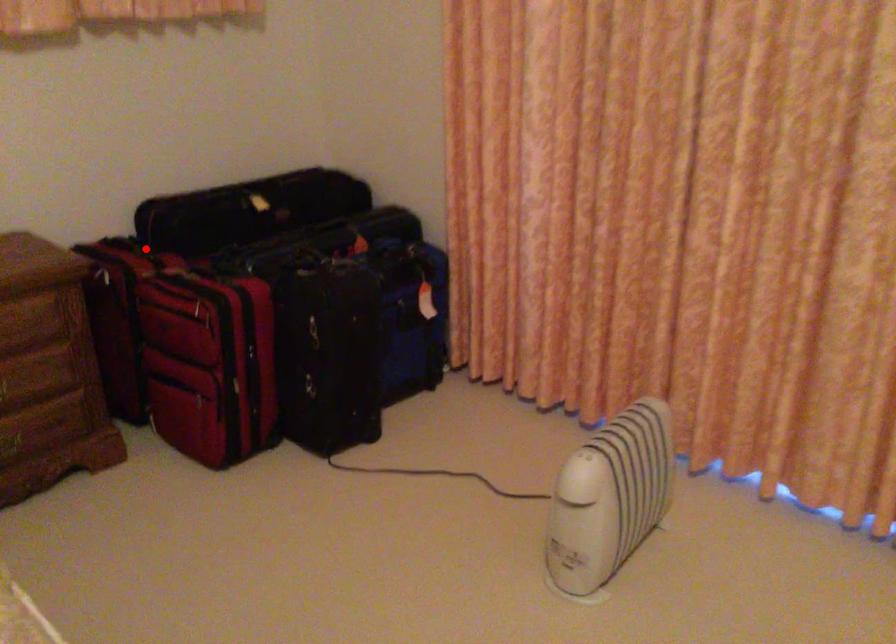
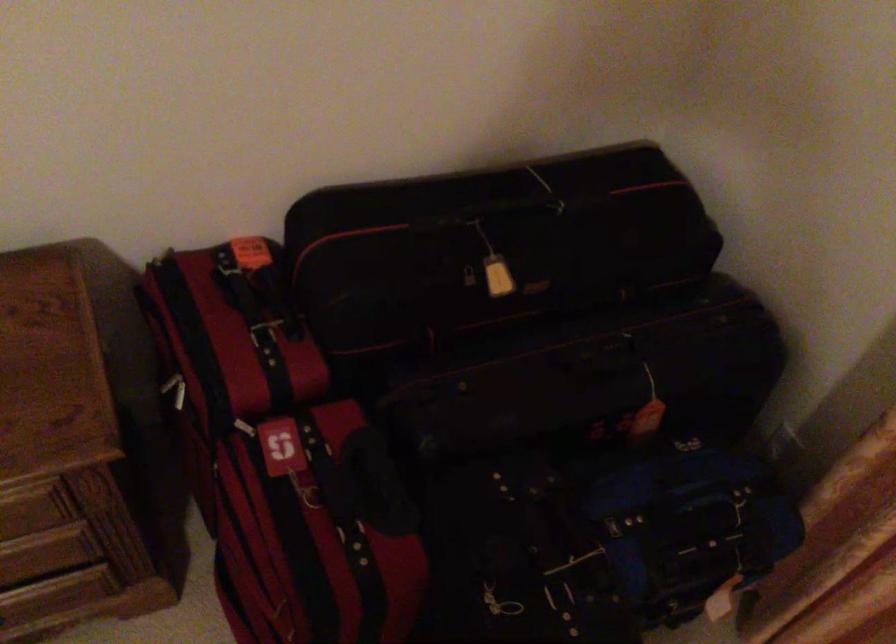
Where in the second image is the point corresponding to the highlighted location from the first image?

(264, 334)